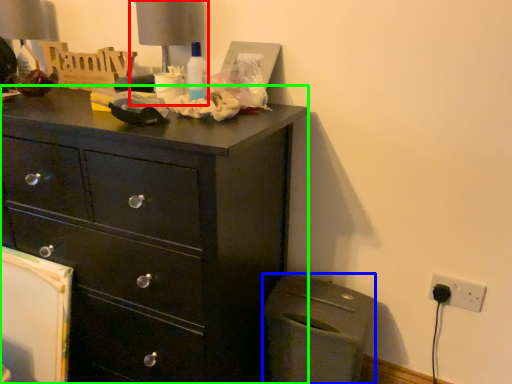
Question: Which is farther away from table lamp (highlighted by a red box)? cabinetry (highlighted by a blue box) or chest of drawers (highlighted by a green box)?

Choices:
 (A) cabinetry
 (B) chest of drawers

Answer: (A)